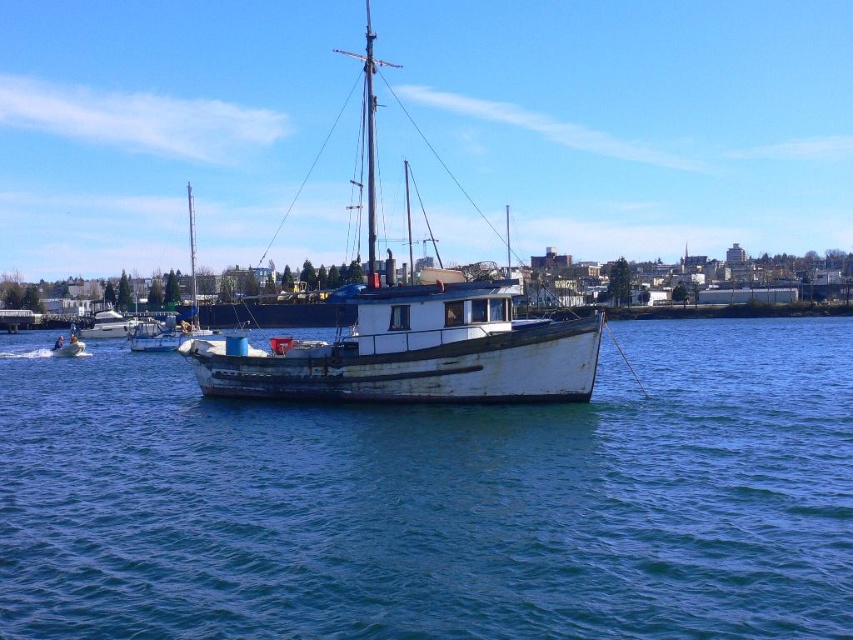
From the picture: Is blue water at center closer to the viewer compared to rusty metal boat at center?

Yes, blue water at center is closer to the viewer.

Who is more forward, (601, 374) or (556, 372)?

Point (556, 372) is in front.

Where is `blue water at center`? The height and width of the screenshot is (640, 853). blue water at center is located at coordinates (437, 500).

At what (x,y) coordinates should I click in order to perform the action: click on rusty metal boat at center. Please return your answer as a coordinate pair (x, y). Looking at the image, I should click on (410, 337).

What do you see at coordinates (410, 337) in the screenshot?
I see `rusty metal boat at center` at bounding box center [410, 337].

Measure the distance between point (374, 36) and camera.

They are 225.43 meters apart.

This screenshot has width=853, height=640. In order to click on rusty metal boat at center in this screenshot , I will do `click(410, 337)`.

Find the location of `rusty metal boat at center`. rusty metal boat at center is located at coordinates (410, 337).

Looking at this image, between rusty metal boat at center and rusty metal boat at left, which one has less height?

rusty metal boat at left is shorter.

The width and height of the screenshot is (853, 640). Describe the element at coordinates (410, 337) in the screenshot. I see `rusty metal boat at center` at that location.

Locate an element on the screen. The width and height of the screenshot is (853, 640). rusty metal boat at center is located at coordinates (410, 337).